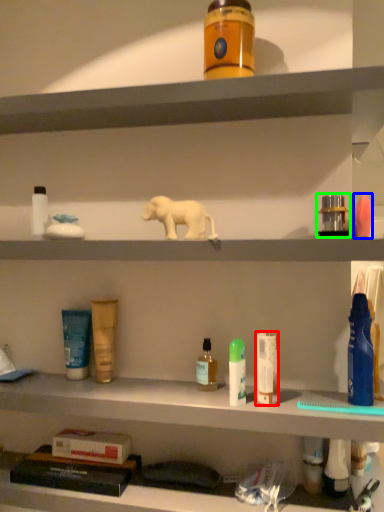
Question: Based on their relative distances, which object is farther from toiletry (highlighted by a red box)? Choose from toiletry (highlighted by a blue box) and toiletry (highlighted by a green box).

Choices:
 (A) toiletry
 (B) toiletry

Answer: (A)